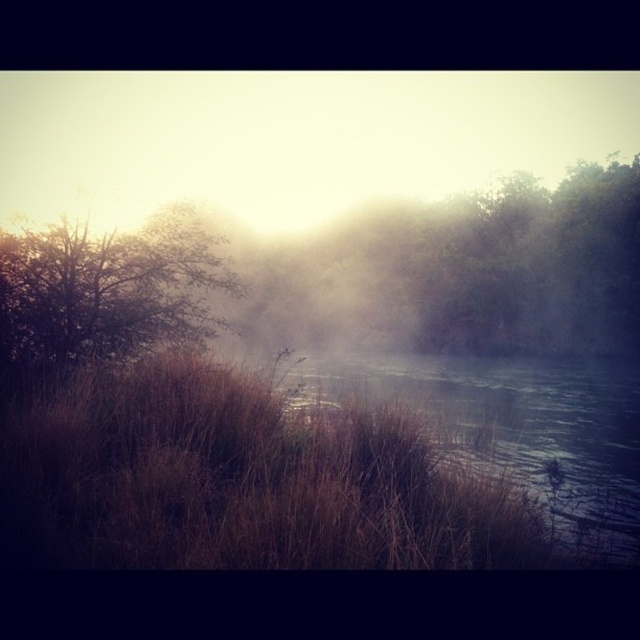
From the picture: You are an observer standing in the middle of the scene. You see the brown matte tree at center and the brown textured tree at left. Which tree is closer to you?

The brown matte tree at center is closer to you because the brown textured tree at left is behind it.

You are an artist trying to paint the scene. You notice two trees in the image. Which tree has a greater width, the brown matte tree at center or the brown textured tree at left?

The brown matte tree at center has a greater width than the brown textured tree at left.

You are standing at the edge of the water in the image and want to walk towards the point marked by the coordinates point (x=515, y=428). Based on the scene description, what will you encounter as you move towards that point?

As you move towards the coordinates point (x=515, y=428), you will encounter the brown grassy river at center.